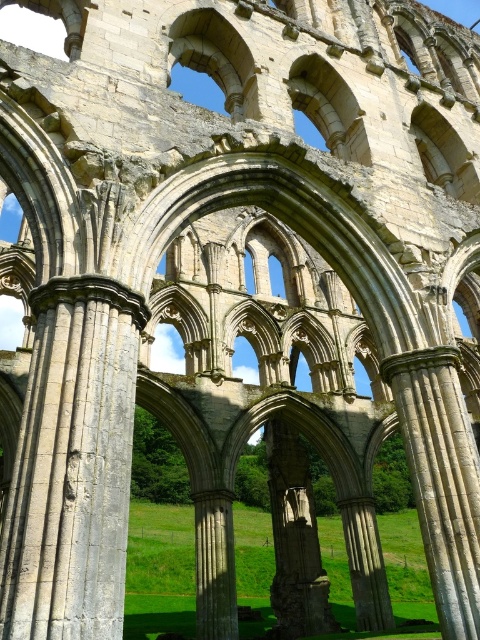
Question: Which of the following is the farthest from the observer?

Choices:
 (A) (x=84, y=426)
 (B) (x=431, y=388)

Answer: (B)

Question: Is gray stone column at center smaller than stone column at center?

Choices:
 (A) no
 (B) yes

Answer: (A)

Question: Which point is farther to the camera?

Choices:
 (A) stone column at center
 (B) gray stone column at center

Answer: (A)

Question: Is gray stone column at center closer to the viewer compared to stone column at center?

Choices:
 (A) yes
 (B) no

Answer: (A)

Question: Can you confirm if gray stone column at center is thinner than stone column at center?

Choices:
 (A) no
 (B) yes

Answer: (A)